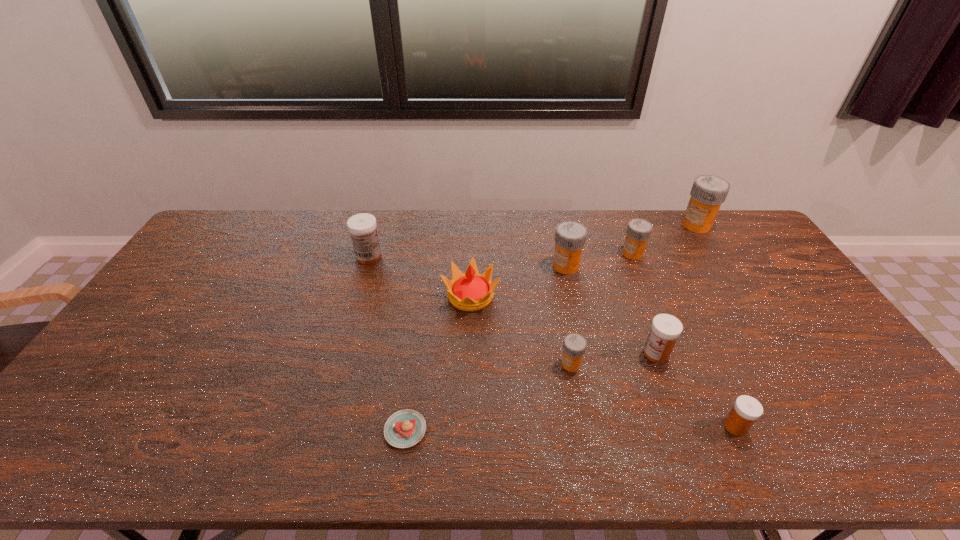
Where is `the nearest medicine`? the nearest medicine is located at coordinates (746, 410).

Where is `the sixth medicine from left to right`? This screenshot has width=960, height=540. the sixth medicine from left to right is located at coordinates (746, 410).

Find the location of a particular element. This screenshot has width=960, height=540. the nearest orange medicine is located at coordinates (574, 346).

Where is `the shortest object`? the shortest object is located at coordinates (405, 428).

Where is `pastry`? This screenshot has width=960, height=540. pastry is located at coordinates (405, 428).

Where is `free spot located 0.220m on the label side of the rightmost object`? This screenshot has height=540, width=960. free spot located 0.220m on the label side of the rightmost object is located at coordinates (623, 225).

Identify the location of free region located 0.160m on the label side of the rightmost object. (638, 225).

Locate an element on the screen. vacant space located 0.310m on the label side of the rightmost object is located at coordinates (599, 225).

Image resolution: width=960 pixels, height=540 pixels. Identify the location of vacant space located on the label side of the third smallest orange medicine. (528, 266).

This screenshot has height=540, width=960. I want to click on vacant area situated on the label side of the third smallest orange medicine, so click(x=445, y=266).